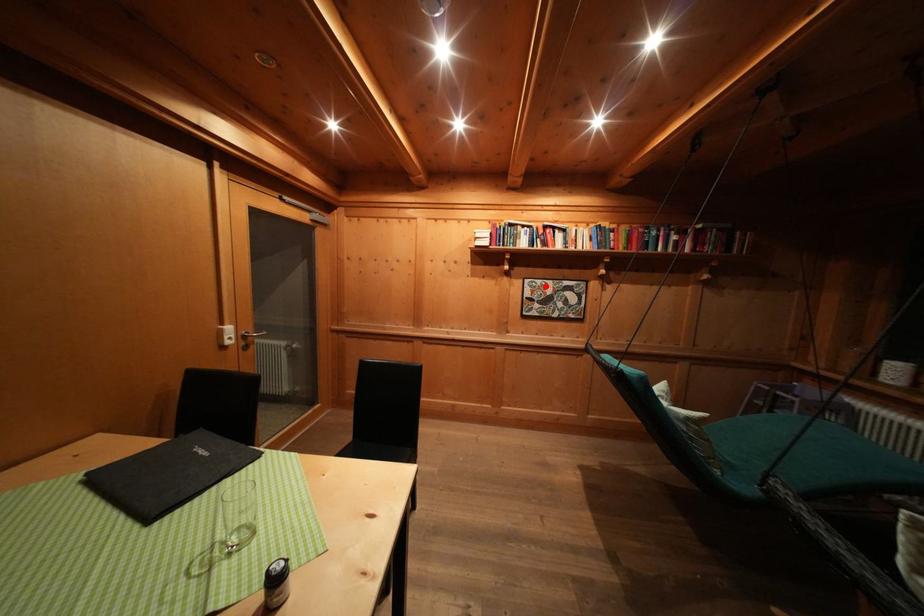
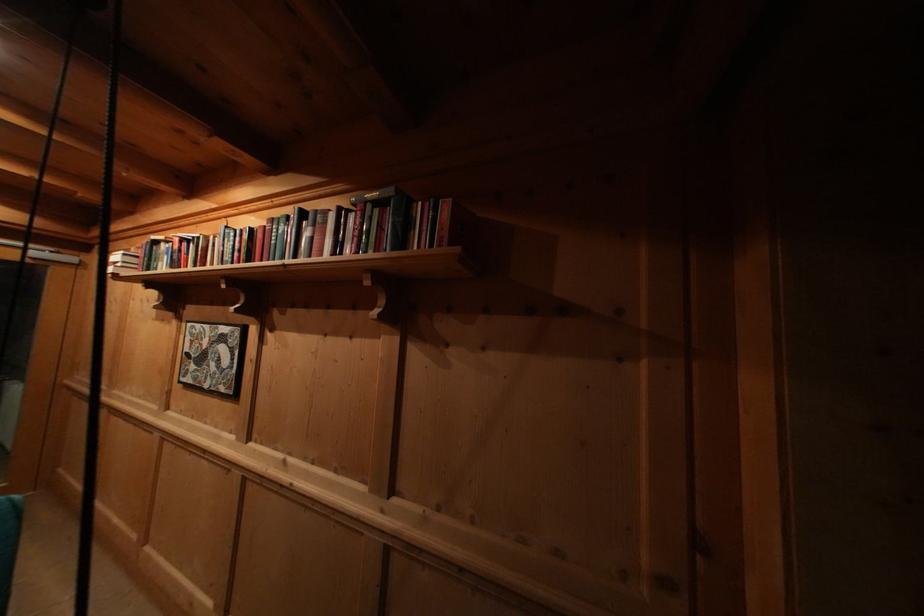
Locate, in the second image, the point that corresponds to the highlighted location in the first image.

(204, 331)